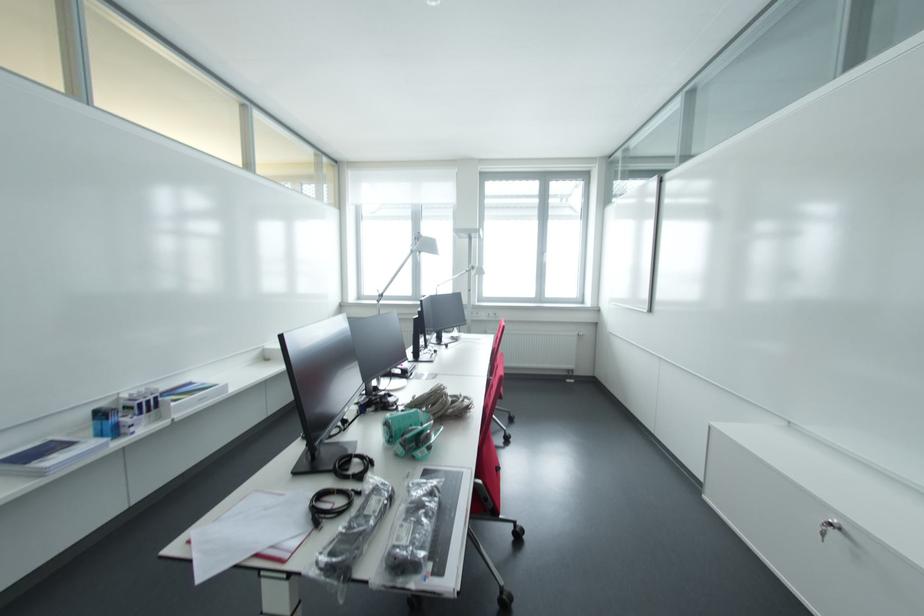
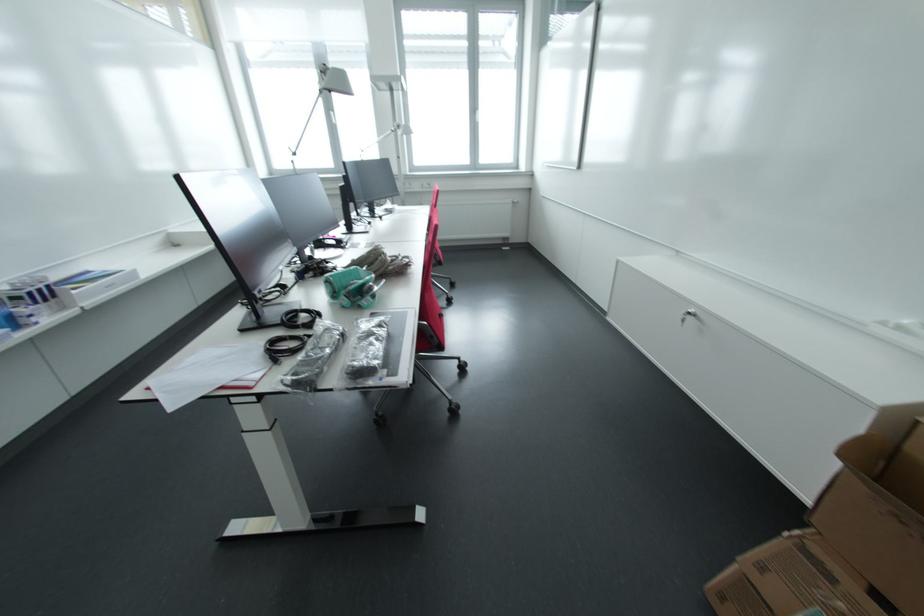
Locate, in the second image, the point that corresponds to point 428,496 in the first image.

(377, 329)